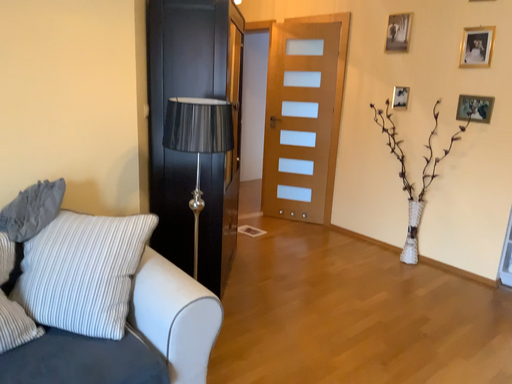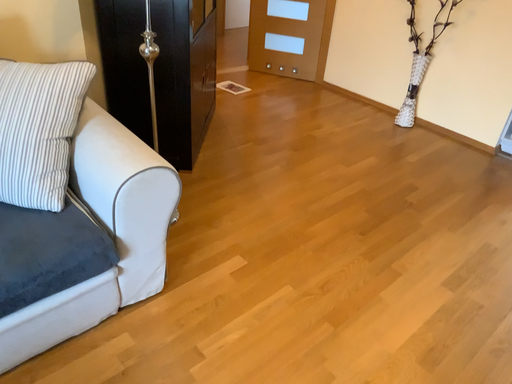
Question: How did the camera likely rotate when shooting the video?

Choices:
 (A) rotated downward
 (B) rotated upward

Answer: (A)